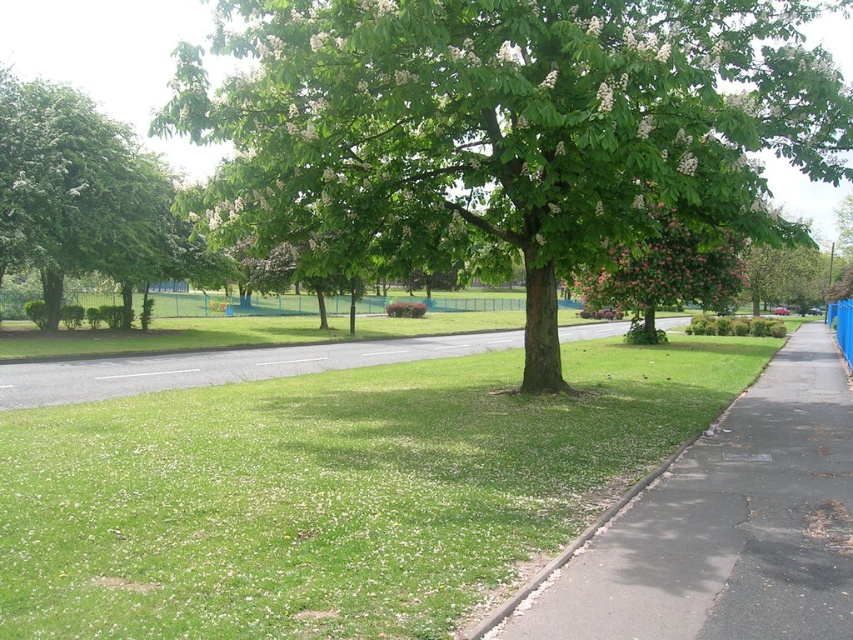
Question: Among these objects, which one is farthest from the camera?

Choices:
 (A) gray asphalt sidewalk at lower right
 (B) green grass at center
 (C) pink flowered tree at center
 (D) green leafy tree at center

Answer: (C)

Question: Does green grass at center come in front of green asphalt at center?

Choices:
 (A) yes
 (B) no

Answer: (A)

Question: Which of the following is the closest to the observer?

Choices:
 (A) (610, 600)
 (B) (218, 364)

Answer: (A)

Question: Does gray asphalt sidewalk at lower right have a larger size compared to pink flowered tree at center?

Choices:
 (A) no
 (B) yes

Answer: (A)

Question: Is green leafy tree at center thinner than green asphalt at center?

Choices:
 (A) no
 (B) yes

Answer: (B)

Question: Which of the following is the farthest from the observer?

Choices:
 (A) (646, 272)
 (B) (30, 401)
 (C) (647, 579)

Answer: (A)